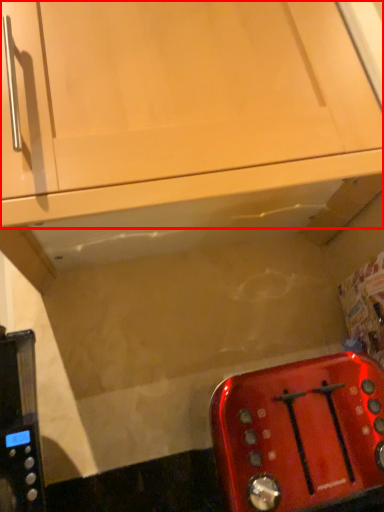
Question: Considering the relative positions of cabinetry (annotated by the red box) and toaster in the image provided, where is cabinetry (annotated by the red box) located with respect to the staircase?

Choices:
 (A) left
 (B) right

Answer: (A)